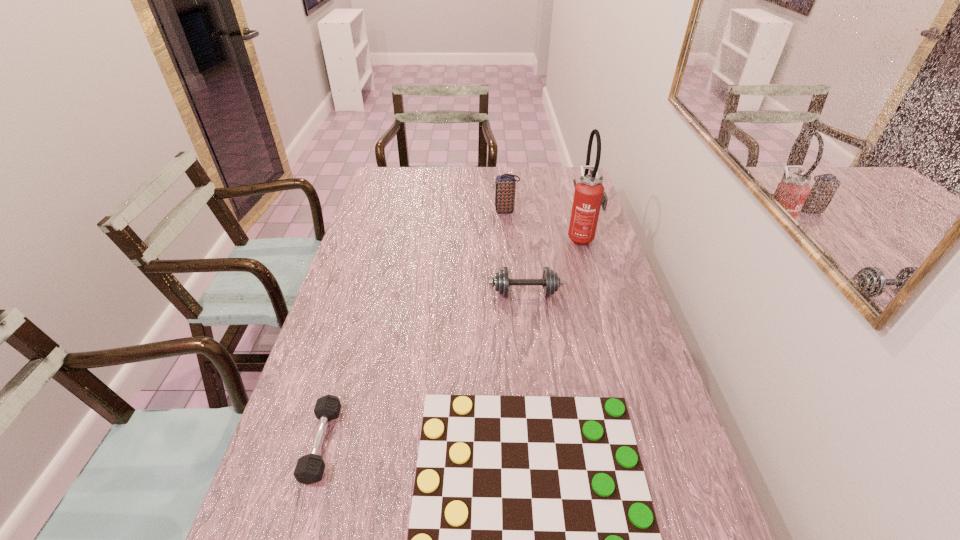
The width and height of the screenshot is (960, 540). I want to click on vacant space at the right edge of the desktop, so click(561, 205).

Locate an element on the screen. This screenshot has height=540, width=960. free point at the far left corner is located at coordinates (379, 171).

The width and height of the screenshot is (960, 540). In the image, there is a desktop. In order to click on vacant space at the far right corner in this screenshot , I will do `click(561, 193)`.

At what (x,y) coordinates should I click in order to perform the action: click on free space between the nearer dumbbell and the farthest object. Please return your answer as a coordinate pair (x, y). The width and height of the screenshot is (960, 540). Looking at the image, I should click on (414, 327).

Find the location of a particular element. This screenshot has width=960, height=540. vacant region between the third nearest object and the leftmost object is located at coordinates (423, 368).

Where is `vacant space that is in between the fourth tallest object and the farthest object`? vacant space that is in between the fourth tallest object and the farthest object is located at coordinates (414, 327).

The image size is (960, 540). In order to click on vacant space that is in between the left dumbbell and the tallest object in this screenshot , I will do `click(452, 340)`.

This screenshot has width=960, height=540. I want to click on empty space that is in between the clutch bag and the right dumbbell, so click(x=516, y=252).

At what (x,y) coordinates should I click in order to perform the action: click on vacant space that's between the fourth shortest object and the third nearest object. Please return your answer as a coordinate pair (x, y). Looking at the image, I should click on (516, 252).

Locate an element on the screen. The image size is (960, 540). vacant space that is in between the right dumbbell and the shorter dumbbell is located at coordinates (423, 368).